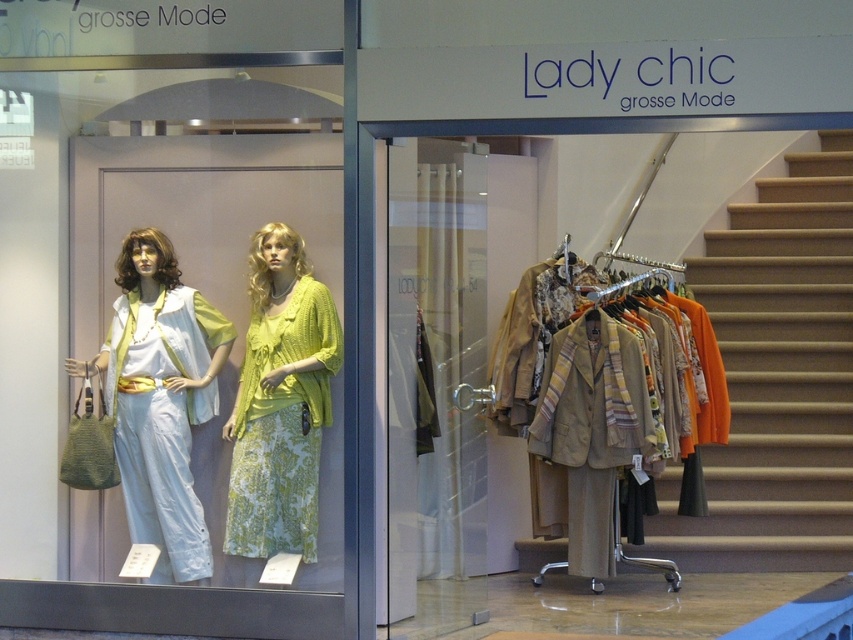
Question: Is matte green fabric dress at center to the right of matte yellow knit cardigan at center from the viewer's perspective?

Choices:
 (A) yes
 (B) no

Answer: (B)

Question: Among these points, which one is nearest to the camera?

Choices:
 (A) (483, 515)
 (B) (601, 408)

Answer: (A)

Question: In this image, where is transparent glass door at center located relative to matte green fabric dress at center?

Choices:
 (A) above
 (B) below

Answer: (A)

Question: Estimate the real-world distances between objects in this image. Which object is closer to the matte yellow knit cardigan at center?

Choices:
 (A) beige wool blazer at center
 (B) transparent glass door at center

Answer: (B)

Question: Can you confirm if matte yellow dress at center is positioned to the right of matte yellow knit cardigan at center?

Choices:
 (A) no
 (B) yes

Answer: (A)

Question: Which point is closer to the camera?

Choices:
 (A) matte yellow knit cardigan at center
 (B) matte green fabric dress at center
 (C) beige wool blazer at center

Answer: (A)